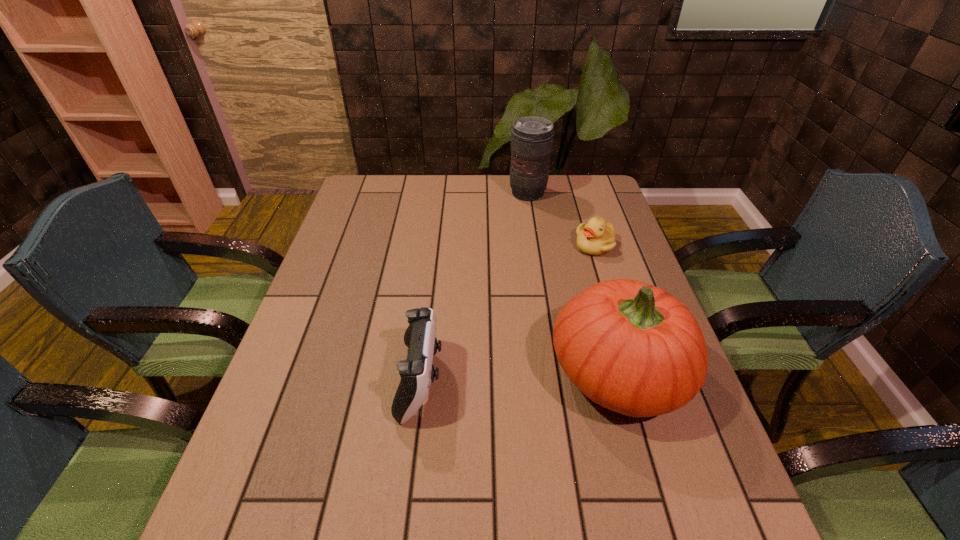
At what (x,y) coordinates should I click in order to perform the action: click on free point located 0.270m on the beak of the duckling. Please return your answer as a coordinate pair (x, y). The height and width of the screenshot is (540, 960). Looking at the image, I should click on (564, 320).

This screenshot has width=960, height=540. I want to click on vacant point located 0.210m on the side of the farthest object where the control switches are located, so click(x=519, y=240).

At what (x,y) coordinates should I click in order to perform the action: click on free spot located 0.050m on the side of the farthest object where the control switches are located. Please return your answer as a coordinate pair (x, y). Looking at the image, I should click on (524, 212).

Identify the location of free space located on the side of the farthest object where the control switches are located. (522, 224).

What are the coordinates of `object that is at the far edge` in the screenshot? It's located at (532, 137).

Locate an element on the screen. pumpkin present at the right edge is located at coordinates (631, 347).

Locate an element on the screen. This screenshot has width=960, height=540. duckling positioned at the right edge is located at coordinates tap(597, 237).

This screenshot has height=540, width=960. I want to click on vacant space at the far edge of the desktop, so click(x=502, y=186).

You are a GUI agent. You are given a task and a screenshot of the screen. Output one action in this format:
    pyautogui.click(x=<x>, y=<y>)
    Task: Click on the free space at the near edge of the desktop
    Image resolution: width=960 pixels, height=540 pixels.
    Given the screenshot: What is the action you would take?
    pyautogui.click(x=333, y=446)

In the image, there is a desktop. At what (x,y) coordinates should I click in order to perform the action: click on free region at the left edge. Please return your answer as a coordinate pair (x, y). Looking at the image, I should click on (361, 307).